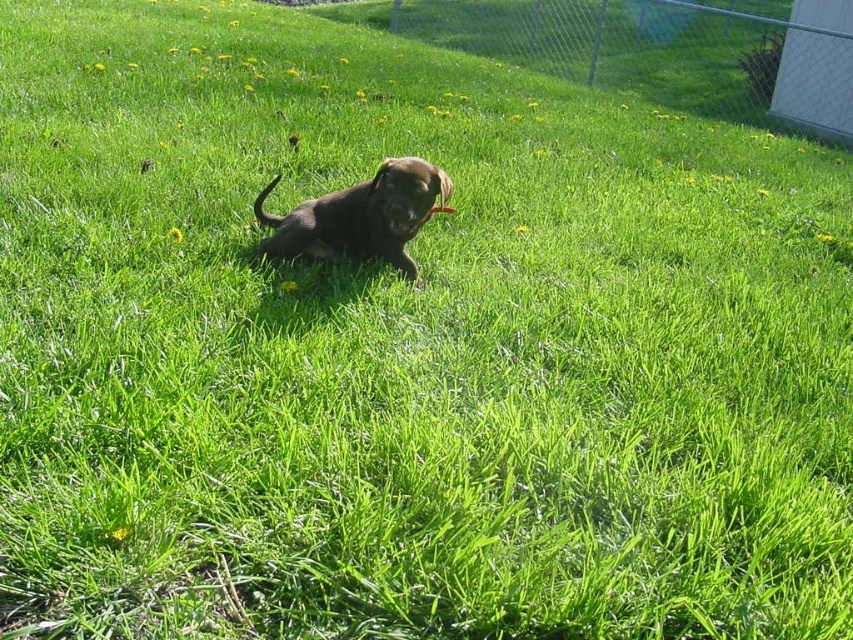
You are a drone operator trying to capture a photo of the puppy. The drone is currently hovering at point (659,52). What is the closest object to the drone at that point?

The closest object to the drone at point (659,52) is the metallic chain link fence at upper right.